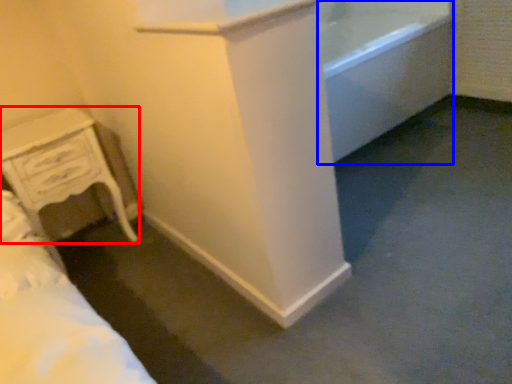
Question: Which point is further to the camera, chest of drawers (highlighted by a red box) or bath (highlighted by a blue box)?

Choices:
 (A) chest of drawers
 (B) bath

Answer: (B)